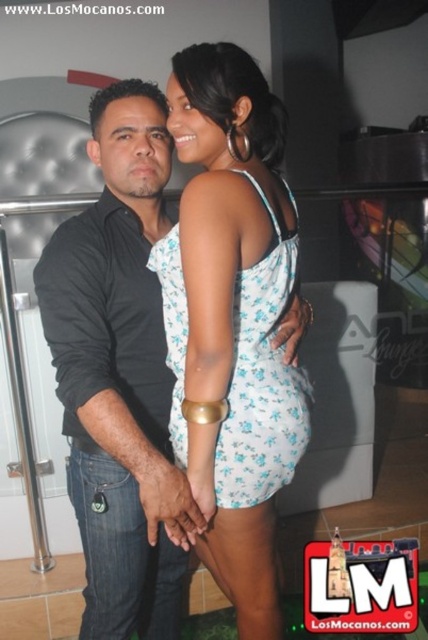
Question: Can you confirm if matte black shirt at left is positioned to the left of white floral fabric dress at center?

Choices:
 (A) yes
 (B) no

Answer: (A)

Question: Does matte black shirt at left appear on the right side of white floral fabric dress at center?

Choices:
 (A) no
 (B) yes

Answer: (A)

Question: Which object appears closest to the camera in this image?

Choices:
 (A) white floral fabric dress at center
 (B) matte black shirt at left

Answer: (A)

Question: Which point is farther to the camera?

Choices:
 (A) white floral fabric dress at center
 (B) matte black shirt at left

Answer: (B)

Question: Does matte black shirt at left come in front of white floral fabric dress at center?

Choices:
 (A) yes
 (B) no

Answer: (B)